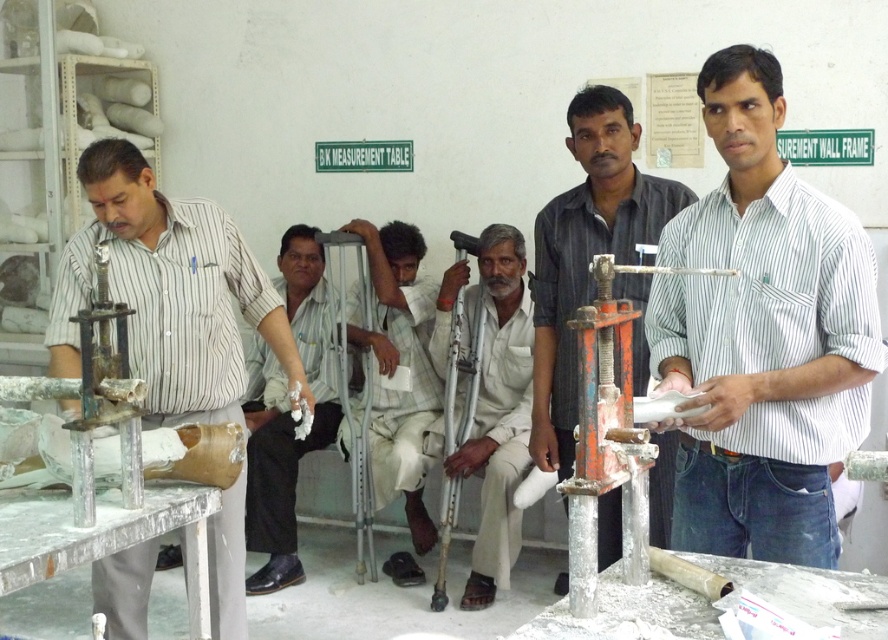
Can you confirm if matte striped shirt at left is bigger than white fabric crutches at center?

Indeed, matte striped shirt at left has a larger size compared to white fabric crutches at center.

This screenshot has height=640, width=888. What do you see at coordinates (169, 292) in the screenshot? I see `matte striped shirt at left` at bounding box center [169, 292].

Who is more forward, (226, 563) or (281, 579)?

Point (226, 563) is in front.

Locate an element on the screen. The width and height of the screenshot is (888, 640). matte striped shirt at left is located at coordinates (169, 292).

Between matte striped shirt at left and white matte crutches at center, which one has more height?

With more height is white matte crutches at center.

Measure the distance between matte striped shirt at left and camera.

The distance of matte striped shirt at left from camera is 8.28 feet.

Where is `matte striped shirt at left`? The height and width of the screenshot is (640, 888). matte striped shirt at left is located at coordinates (169, 292).

Who is positioned more to the right, white striped shirt at center or white checkered shirt at center?

white striped shirt at center

Is point (744, 227) positioned in front of point (393, 429)?

That is True.

Find the location of a particular element. This screenshot has height=640, width=888. white striped shirt at center is located at coordinates (762, 336).